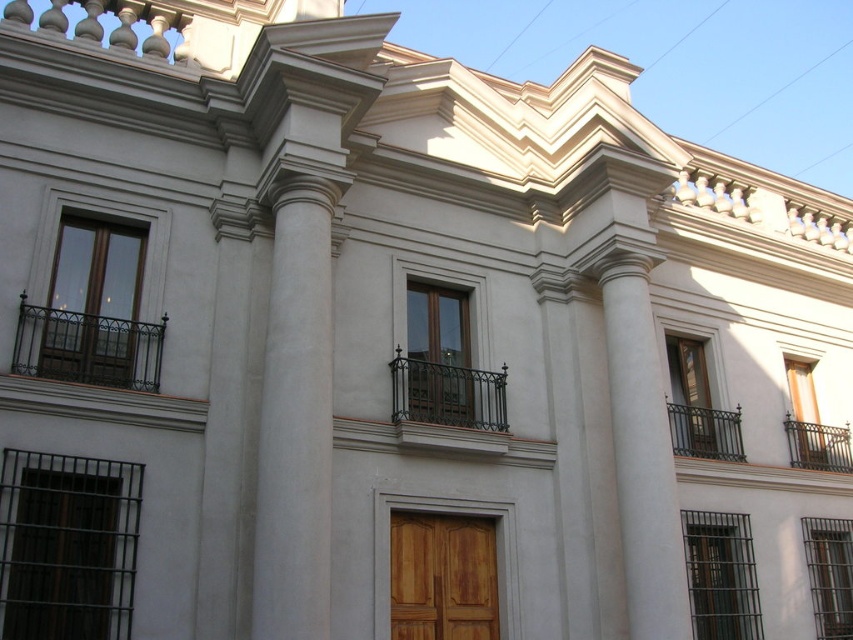
Question: Where is wooden at center located in relation to green wrought iron balcony at lower right in the image?

Choices:
 (A) right
 (B) left

Answer: (B)

Question: Which point is closer to the camera taking this photo?

Choices:
 (A) (819, 444)
 (B) (474, 554)

Answer: (B)

Question: In this image, where is wooden at center located relative to green wrought iron balcony at lower right?

Choices:
 (A) above
 (B) below

Answer: (B)

Question: Among these points, which one is farthest from the camera?

Choices:
 (A) (469, 589)
 (B) (709, 476)

Answer: (B)

Question: Where is wooden at center located in relation to green wrought iron balcony at lower right in the image?

Choices:
 (A) left
 (B) right

Answer: (A)

Question: Which point is farther from the camera taking this photo?

Choices:
 (A) (689, 436)
 (B) (477, 595)

Answer: (A)